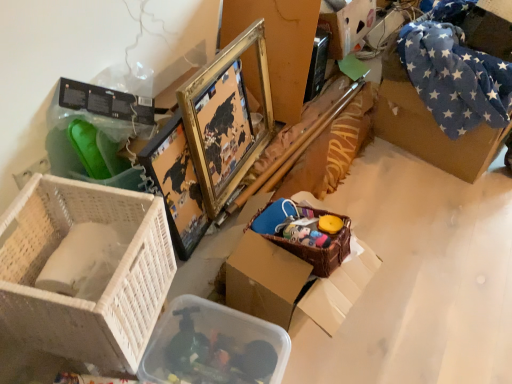
Question: From their relative heights in the image, would you say white wicker basket at lower left is taller or shorter than cardboard box at upper right, positioned as the 1th storage box in back-to-front order?

Choices:
 (A) short
 (B) tall

Answer: (B)

Question: From a real-world perspective, is white wicker basket at lower left physically located above or below cardboard box at upper right, the second storage box when ordered from bottom to top?

Choices:
 (A) above
 (B) below

Answer: (A)

Question: Which object is positioned farthest from the gold metallic picture frame at upper center?

Choices:
 (A) cardboard box at upper right, the second storage box positioned from the left
 (B) brown woven basket at lower right
 (C) blue fleece blanket at upper right
 (D) translucent plastic container at lower center, marked as the 1th storage box in a front-to-back arrangement
 (E) white wicker basket at lower left

Answer: (C)

Question: Which object is positioned farthest from the gold metallic picture frame at upper center?

Choices:
 (A) white wicker basket at lower left
 (B) cardboard box at upper right, marked as the 1th storage box in a right-to-left arrangement
 (C) blue fleece blanket at upper right
 (D) translucent plastic container at lower center, placed as the 1th storage box when sorted from bottom to top
 (E) brown woven basket at lower right

Answer: (C)